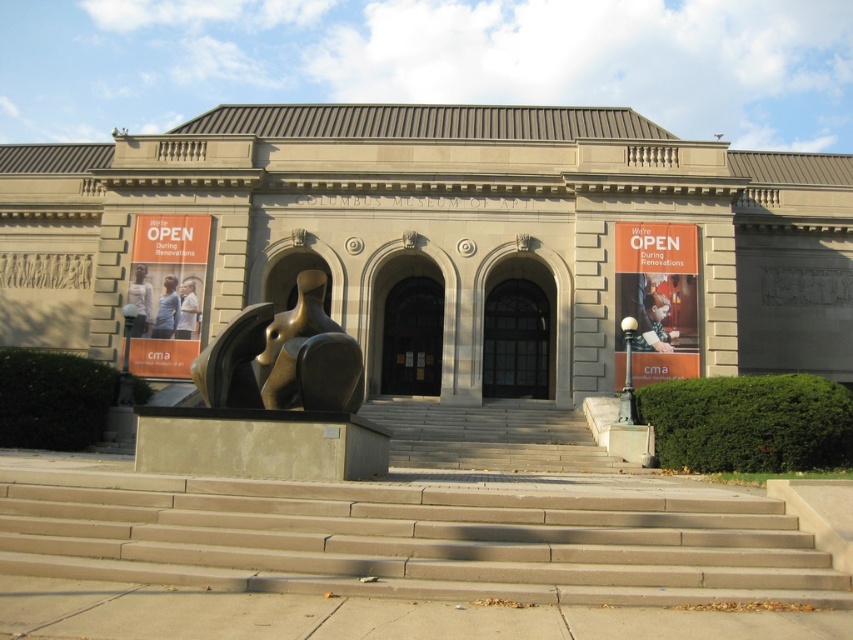
Question: Based on their relative distances, which object is nearer to the gray concrete stairs at center?

Choices:
 (A) dark gray stone archway at center
 (B) concrete stairs at center

Answer: (A)

Question: Can you confirm if bronze sculpture at center is positioned above light brown leather jacket at lower left?

Choices:
 (A) yes
 (B) no

Answer: (B)

Question: Based on their relative distances, which object is farther from the dark gray stone archway at center?

Choices:
 (A) gray concrete stairs at center
 (B) light brown leather jacket at center

Answer: (B)

Question: Which point is farther from the camera taking this photo?

Choices:
 (A) (180, 292)
 (B) (167, 333)
 (C) (314, 388)
 (D) (495, 337)

Answer: (D)

Question: Is bronze sculpture at center below light brown leather jacket at lower left?

Choices:
 (A) yes
 (B) no

Answer: (A)

Question: Is the position of bronze sculpture at center more distant than that of clear glass door at center?

Choices:
 (A) yes
 (B) no

Answer: (B)